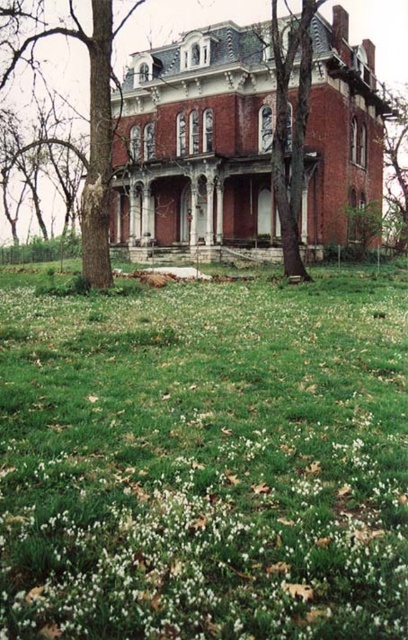
Question: Which object appears farthest from the camera in this image?

Choices:
 (A) green grass at center
 (B) smooth bark tree at upper right

Answer: (B)

Question: Which of these objects is positioned farthest from the stone steps at center?

Choices:
 (A) smooth bark tree at upper right
 (B) green grass at center

Answer: (A)

Question: Among these points, which one is nearest to the camera?

Choices:
 (A) tap(401, 205)
 (B) tap(217, 618)
 (C) tap(277, 246)

Answer: (B)

Question: Observing the image, what is the correct spatial positioning of green grass at center in reference to smooth bark tree at upper right?

Choices:
 (A) above
 (B) below

Answer: (B)

Question: Does green grass at center appear on the right side of stone steps at center?

Choices:
 (A) no
 (B) yes

Answer: (B)

Question: Does green grass at center have a greater width compared to stone steps at center?

Choices:
 (A) no
 (B) yes

Answer: (B)